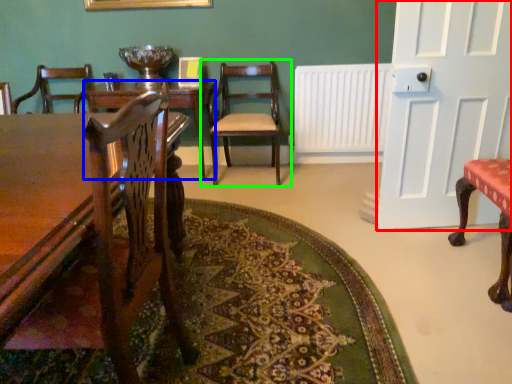
Question: Estimate the real-world distances between objects in this image. Which object is farther from door (highlighted by a red box), table (highlighted by a blue box) or chair (highlighted by a green box)?

Choices:
 (A) table
 (B) chair

Answer: (A)